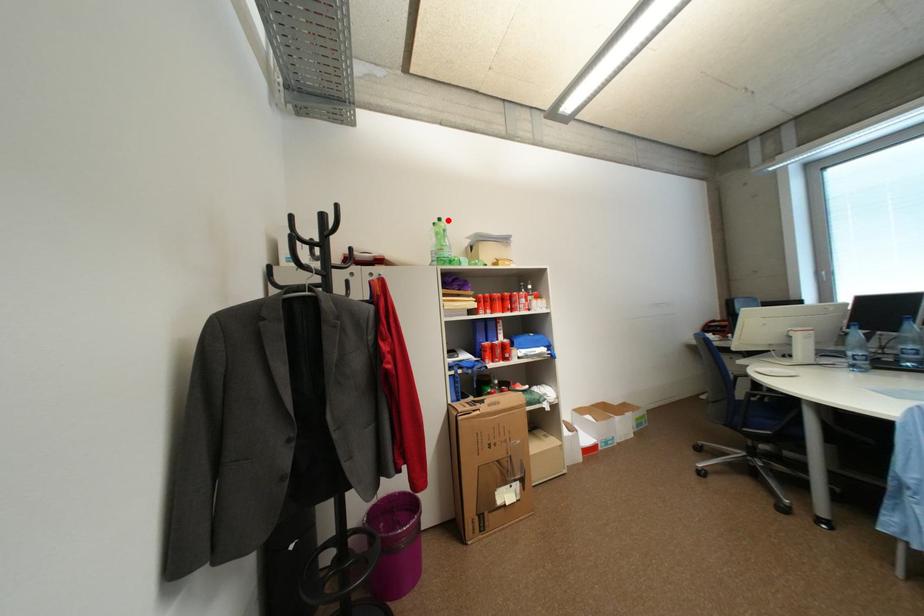
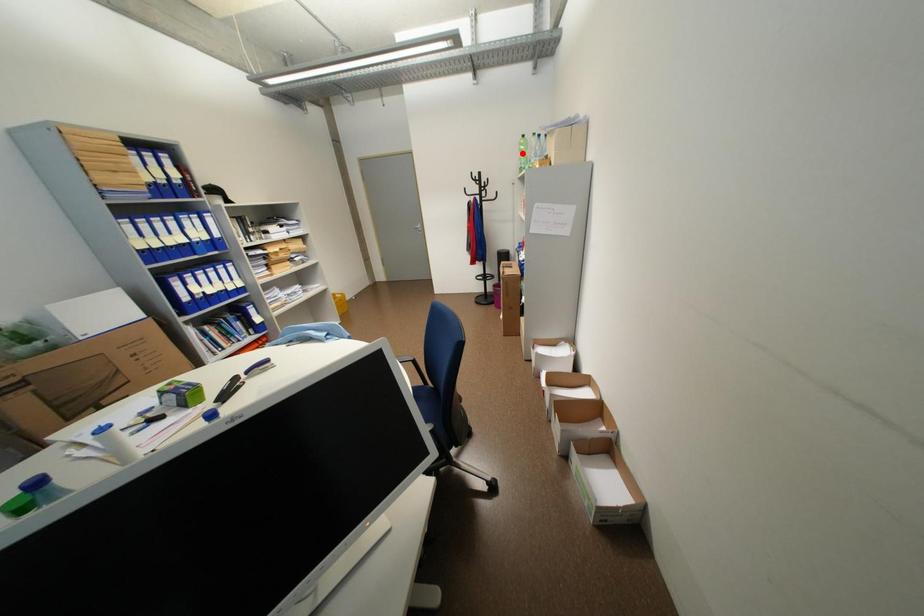
I am providing you with two images of the same scene from different viewpoints. A red point is marked on the first image and another point is marked on the second image. Do the highlighted points in image1 and image2 indicate the same real-world spot?

No